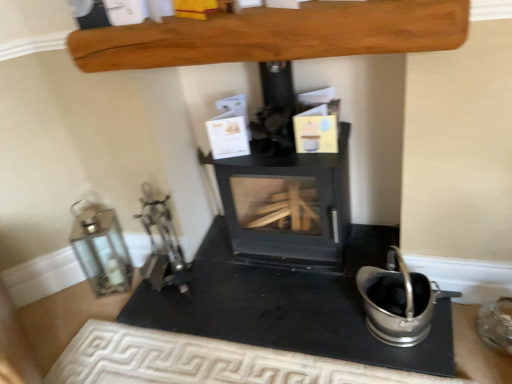
Find the location of a particular element. free space in front of black matte wood burning stove at center is located at coordinates (295, 304).